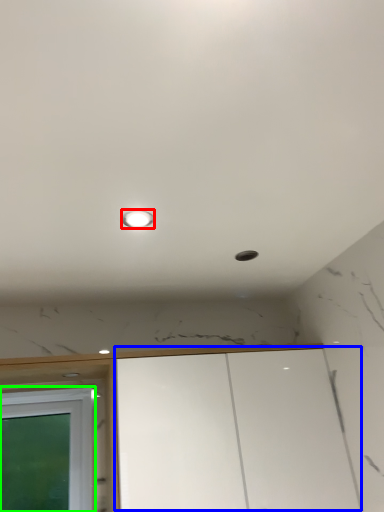
Question: Which object is the farthest from light (highlighted by a red box)? Choose among these: cabinetry (highlighted by a blue box) or window (highlighted by a green box).

Choices:
 (A) cabinetry
 (B) window

Answer: (B)